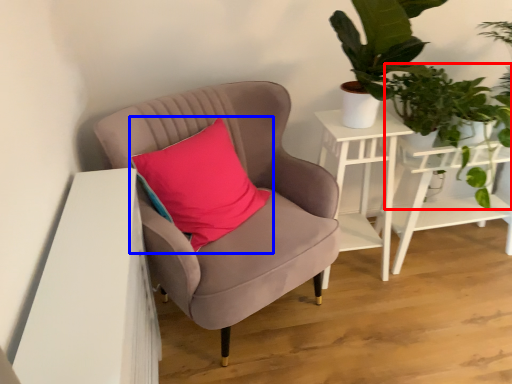
Question: Which of the following is the closest to the observer, vegetation (highlighted by a red box) or pillow (highlighted by a blue box)?

Choices:
 (A) vegetation
 (B) pillow

Answer: (B)